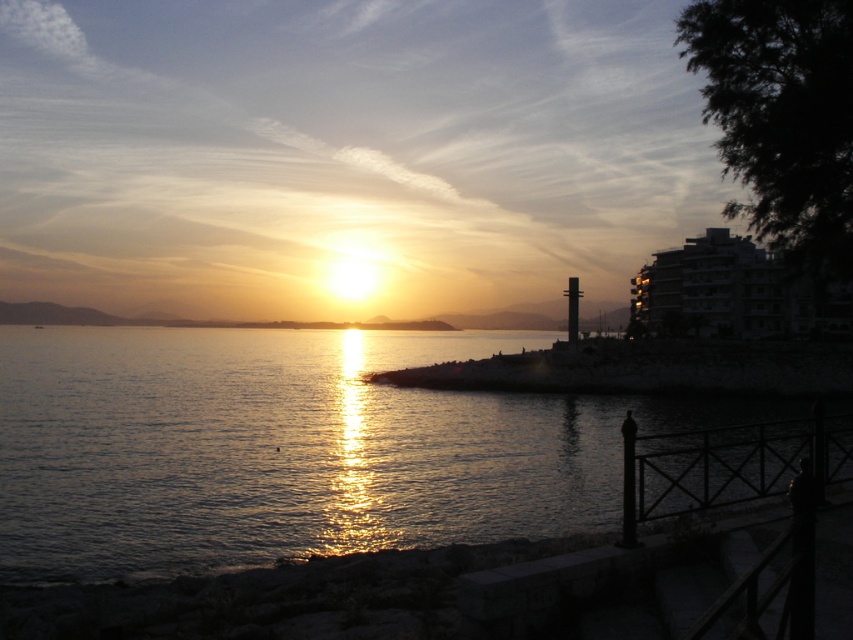
You are standing on the paved walkway and looking out at the scene. Which object occupies a larger area in the image, the glistening water at center or the dark stone shoreline at lower center?

The glistening water at center is bigger than the dark stone shoreline at lower center, so it occupies a larger area in the image.

Based on the scene description, where is the glistening water at center located in the image?

The glistening water at center is located at the point with coordinates 0.700 in the x axis and 0.343 in the y axis.